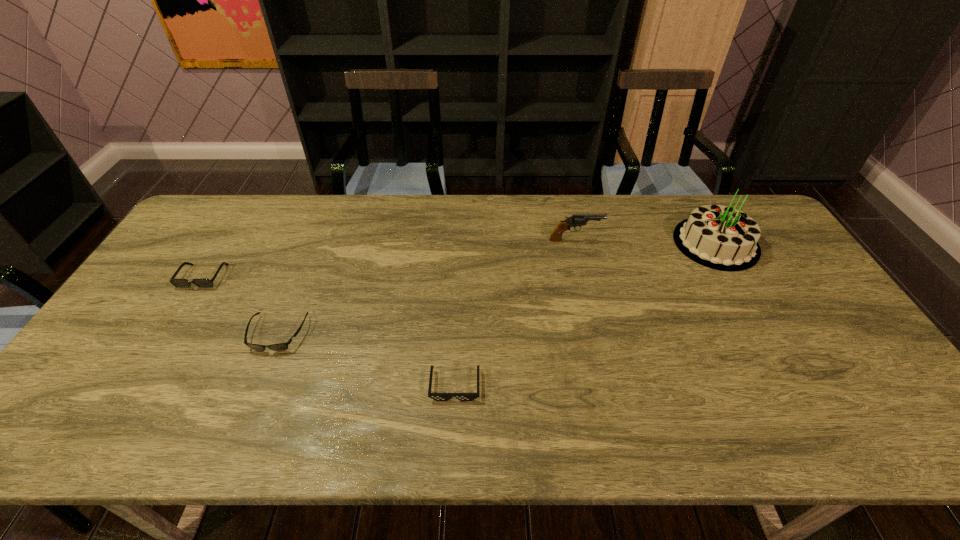
This screenshot has width=960, height=540. Find the location of `free region located on the left of the tallest object`. free region located on the left of the tallest object is located at coordinates (591, 243).

This screenshot has height=540, width=960. Identify the location of vacant space located along the barrel of the gun. (709, 240).

Where is `free space located on the front-facing side of the farthest sunglasses`? Image resolution: width=960 pixels, height=540 pixels. free space located on the front-facing side of the farthest sunglasses is located at coordinates (121, 406).

Identify the location of blank area located on the front-facing side of the second sunglasses from right to left. The width and height of the screenshot is (960, 540). (258, 382).

Where is `birthday cake at the far edge`? The height and width of the screenshot is (540, 960). birthday cake at the far edge is located at coordinates (723, 238).

This screenshot has height=540, width=960. I want to click on gun present at the far edge, so coord(575,220).

Locate an element on the screen. object located in the left edge section of the desktop is located at coordinates (179, 283).

The height and width of the screenshot is (540, 960). Identify the location of object that is at the right edge. (723, 238).

The width and height of the screenshot is (960, 540). In order to click on object positioned at the far right corner in this screenshot , I will do `click(723, 238)`.

At what (x,y) coordinates should I click in order to perform the action: click on free location at the far edge. Please return your answer as a coordinate pair (x, y). Image resolution: width=960 pixels, height=540 pixels. Looking at the image, I should click on (378, 225).